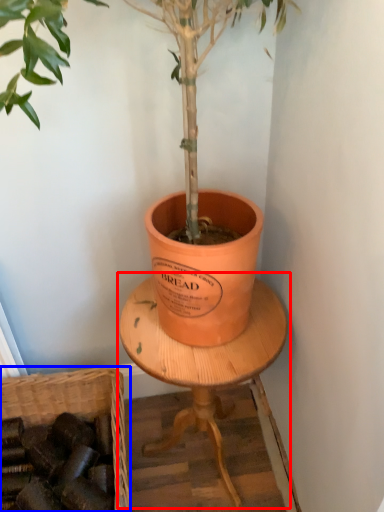
Question: Which object appears closest to the camera in this image, round table (highlighted by a red box) or basket (highlighted by a blue box)?

Choices:
 (A) round table
 (B) basket

Answer: (A)